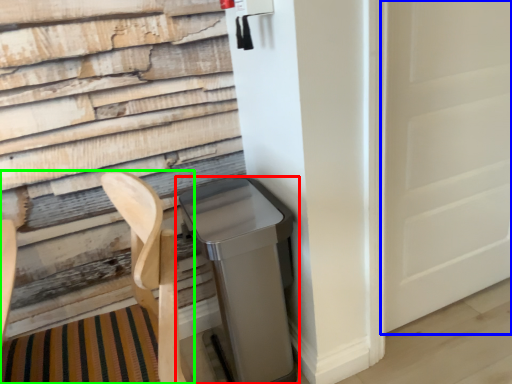
Question: Based on their relative distances, which object is farther from waste container (highlighted by a red box)? Choose from screen door (highlighted by a blue box) and folding chair (highlighted by a green box).

Choices:
 (A) screen door
 (B) folding chair

Answer: (A)